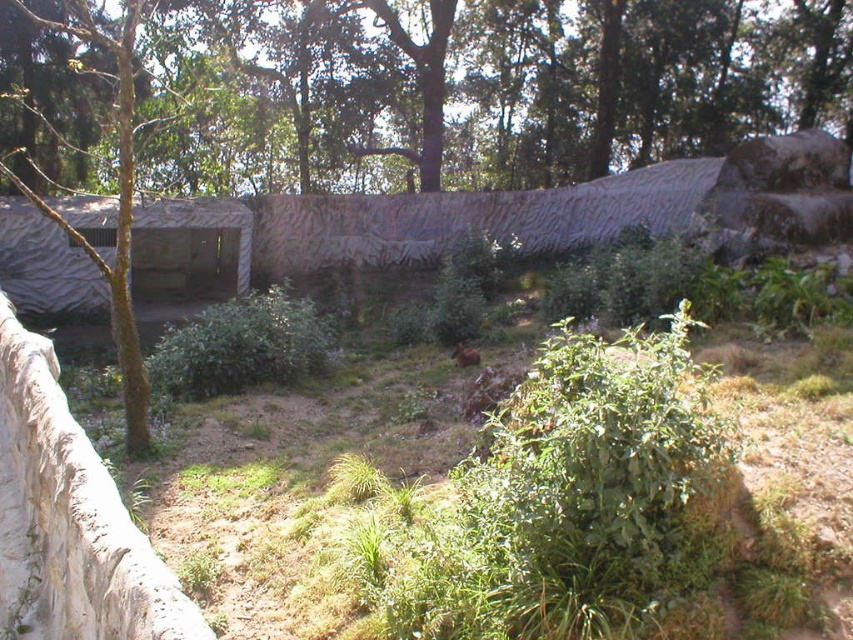
Question: Does green leafy tree at center lie behind camouflage fabric hut at left?

Choices:
 (A) no
 (B) yes

Answer: (A)

Question: Which point is farther to the camera?

Choices:
 (A) camouflage fabric hut at left
 (B) green leafy tree at center
 (C) brown fur animal at center

Answer: (A)

Question: Which point appears closest to the camera in this image?

Choices:
 (A) (236, 264)
 (B) (461, 362)
 (C) (715, 67)

Answer: (B)

Question: Does green leafy tree at upper center have a lesser width compared to camouflage fabric hut at left?

Choices:
 (A) no
 (B) yes

Answer: (A)

Question: In this image, where is green leafy tree at center located relative to camouflage fabric hut at left?

Choices:
 (A) below
 (B) above

Answer: (B)

Question: Which of the following is the closest to the observer?

Choices:
 (A) (96, 296)
 (B) (460, 365)
 (C) (210, 240)

Answer: (B)